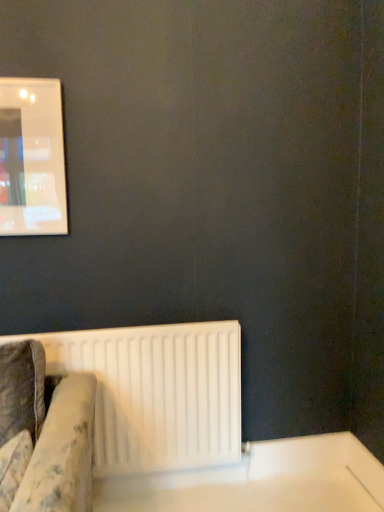
I want to click on white plastic radiator at lower left, so click(x=157, y=393).

Describe the element at coordinates (157, 393) in the screenshot. Image resolution: width=384 pixels, height=512 pixels. I see `white plastic radiator at lower left` at that location.

What is the approximate height of white plastic radiator at lower left?

white plastic radiator at lower left is 28.03 inches in height.

What are the coordinates of `white glossy table at lower right` in the screenshot? It's located at 261,481.

The height and width of the screenshot is (512, 384). Describe the element at coordinates (261, 481) in the screenshot. I see `white glossy table at lower right` at that location.

Measure the distance between white glossy table at lower right and camera.

white glossy table at lower right is 6.11 feet from camera.

The height and width of the screenshot is (512, 384). In order to click on white plastic radiator at lower left in this screenshot , I will do `click(157, 393)`.

Can you confirm if white glossy table at lower right is positioned to the right of white plastic radiator at lower left?

Correct, you'll find white glossy table at lower right to the right of white plastic radiator at lower left.

Which object is further away from the camera, white glossy table at lower right or white plastic radiator at lower left?

Positioned behind is white plastic radiator at lower left.

Considering the points (202, 498) and (108, 463), which point is in front, point (202, 498) or point (108, 463)?

Point (108, 463)

Consider the image. From the image's perspective, is white glossy table at lower right located above or below white plastic radiator at lower left?

white glossy table at lower right is below white plastic radiator at lower left.

From a real-world perspective, is white glossy table at lower right above or below white plastic radiator at lower left?

Clearly, from a real-world perspective, white glossy table at lower right is below white plastic radiator at lower left.

Can you confirm if white glossy table at lower right is thinner than white plastic radiator at lower left?

Incorrect, the width of white glossy table at lower right is not less than that of white plastic radiator at lower left.

Considering the sizes of white glossy table at lower right and white plastic radiator at lower left in the image, is white glossy table at lower right taller or shorter than white plastic radiator at lower left?

In the image, white glossy table at lower right appears to be shorter than white plastic radiator at lower left.

Which of these two, white glossy table at lower right or white plastic radiator at lower left, is smaller?

With smaller size is white glossy table at lower right.

Is white glossy table at lower right inside or outside of white plastic radiator at lower left?

white glossy table at lower right is not inside white plastic radiator at lower left, it's outside.

Is white glossy table at lower right far from white plastic radiator at lower left?

white glossy table at lower right is near white plastic radiator at lower left, not far away.

Is white glossy table at lower right facing towards white plastic radiator at lower left?

No, white glossy table at lower right is not turned towards white plastic radiator at lower left.

How far apart are white glossy table at lower right and white plastic radiator at lower left?

They are 14.52 inches apart.

Locate an element on the screen. This screenshot has width=384, height=512. radiator that appears above the white glossy table at lower right (from the image's perspective) is located at coordinates (157, 393).

Is white plastic radiator at lower left to the right of white glossy table at lower right from the viewer's perspective?

Incorrect, white plastic radiator at lower left is not on the right side of white glossy table at lower right.

Does white plastic radiator at lower left lie behind white glossy table at lower right?

Yes, white plastic radiator at lower left is further from the camera.

Is point (104, 368) less distant than point (145, 496)?

Yes, point (104, 368) is in front of point (145, 496).

From the image's perspective, who appears lower, white plastic radiator at lower left or white glossy table at lower right?

From the image's view, white glossy table at lower right is below.

From a real-world perspective, who is located higher, white plastic radiator at lower left or white glossy table at lower right?

white plastic radiator at lower left is physically above.

Which of these two, white plastic radiator at lower left or white glossy table at lower right, is thinner?

white plastic radiator at lower left is thinner.

In the scene shown: Between white plastic radiator at lower left and white glossy table at lower right, which one has more height?

Standing taller between the two is white plastic radiator at lower left.

In the scene shown: Considering the sizes of white plastic radiator at lower left and white glossy table at lower right in the image, is white plastic radiator at lower left bigger or smaller than white glossy table at lower right?

Considering their sizes, white plastic radiator at lower left takes up more space than white glossy table at lower right.

Would you say white plastic radiator at lower left contains white glossy table at lower right?

No.

Is white plastic radiator at lower left next to white glossy table at lower right and touching it?

white plastic radiator at lower left and white glossy table at lower right are clearly separated.

Is white plastic radiator at lower left oriented towards white glossy table at lower right?

No, white plastic radiator at lower left is not turned towards white glossy table at lower right.

Where is `table in front of the white plastic radiator at lower left`? table in front of the white plastic radiator at lower left is located at coordinates [x=261, y=481].

Locate an element on the screen. Image resolution: width=384 pixels, height=512 pixels. radiator behind the white glossy table at lower right is located at coordinates (157, 393).

The width and height of the screenshot is (384, 512). What are the coordinates of `table that appears on the right of white plastic radiator at lower left` in the screenshot? It's located at click(x=261, y=481).